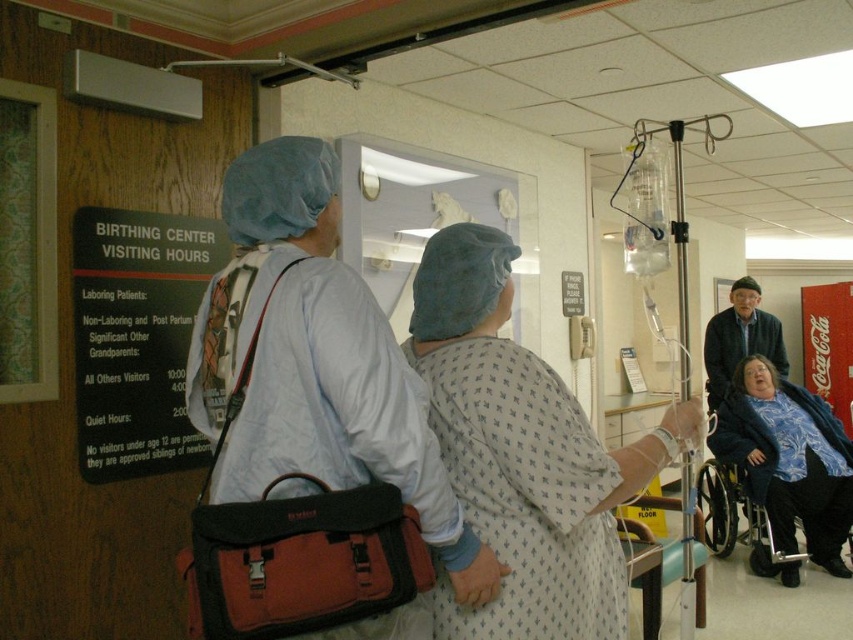
You are a visitor at the birthing center and need to check the visiting hours. You see a black cardboard sign at left and a dark blue knit sweater at right. Which object is taller?

The dark blue knit sweater at right is taller than the black cardboard sign at left.

You are a nurse in the birthing center and need to hang both the black cardboard sign at left and the clear plastic iv bag at center on a wall. The wall has limited space. Based on the scene, which object should you hang first to ensure both fit?

The black cardboard sign at left should be hung first because it occupies less space than the clear plastic iv bag at center, allowing both to fit on the wall.

You are a hospital administrator reviewing the layout of the birthing center. You notice the black cardboard sign at left and the dark blue knit sweater at right. Which object takes up more space in the image?

The dark blue knit sweater at right takes up more space in the image because the black cardboard sign at left has a smaller size compared to it.